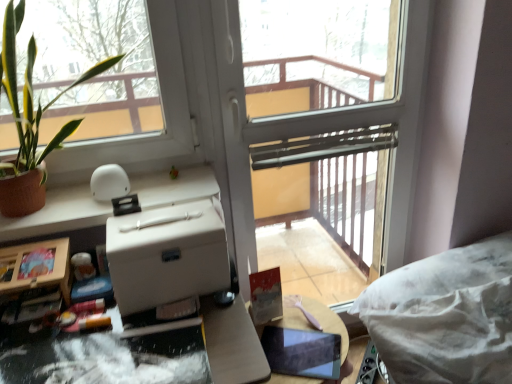
Locate an element on the screen. The width and height of the screenshot is (512, 384). free point above white matte cardboard box at center (from a real-world perspective) is located at coordinates (169, 218).